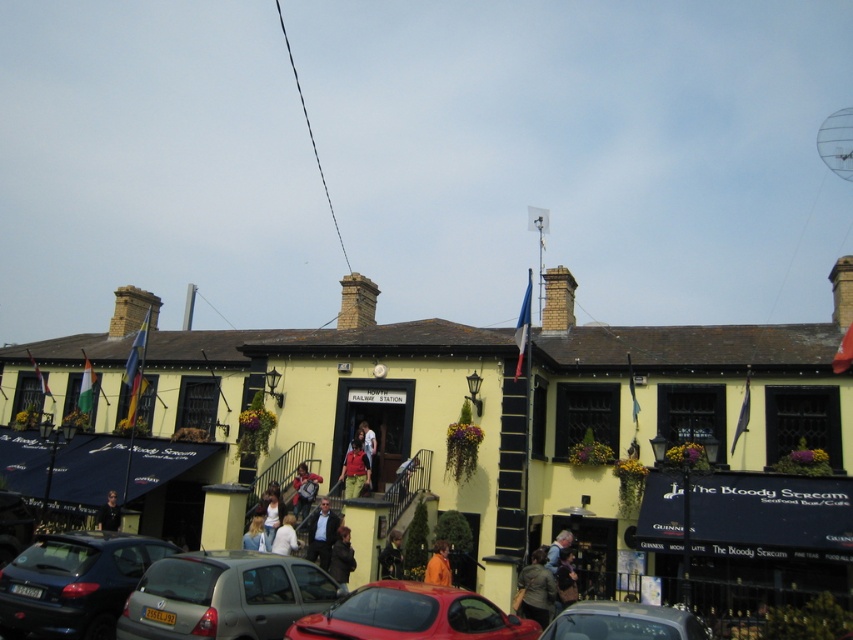
You are standing at the bottom of the stairs in the street scene and want to find the light blue shirt at center. Based on the coordinates provided, in which direction should you look to locate it?

The light blue shirt at center is located at coordinates point (285,536), which means it is positioned towards the upper right direction from your current position at the bottom of the stairs.

You are standing at the entrance of The Bloody Stream pub and want to find your friend who is waiting near the point at coordinate (223,596). Which vehicle should you look for?

The point at coordinate (223,596) is on the matte gray hatchback at lower center, so you should look for the matte gray hatchback at lower center.